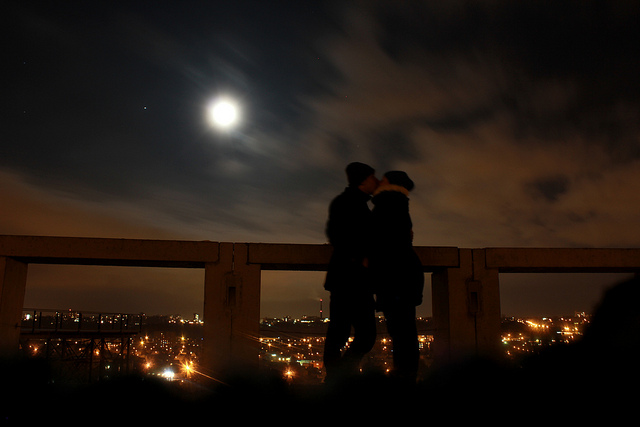
I want to click on coat, so click(x=347, y=221), click(x=402, y=221).